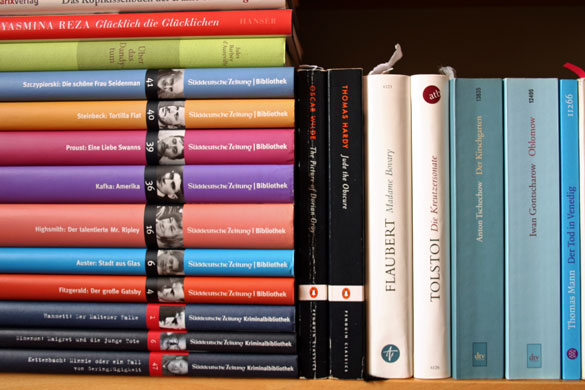
You are a GUI agent. You are given a task and a screenshot of the screen. Output one action in this format:
    pyautogui.click(x=<x>, y=<y>)
    Task: Click on the books with a persons face on the side of the book
    This screenshot has width=585, height=390.
    Given the screenshot: What is the action you would take?
    pyautogui.click(x=170, y=361), pyautogui.click(x=172, y=346), pyautogui.click(x=178, y=319), pyautogui.click(x=172, y=288), pyautogui.click(x=170, y=262), pyautogui.click(x=176, y=233), pyautogui.click(x=175, y=191), pyautogui.click(x=175, y=141), pyautogui.click(x=175, y=123), pyautogui.click(x=174, y=85)